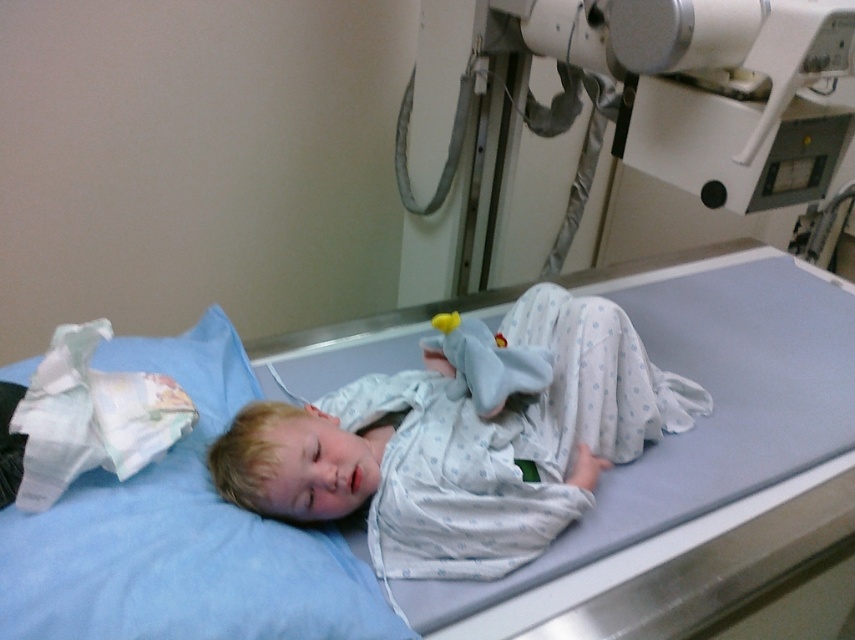
Does light blue fabric at center have a larger size compared to metallic gray machine at upper right?

Yes.

Can you confirm if light blue fabric at center is positioned to the right of metallic gray machine at upper right?

No, light blue fabric at center is not to the right of metallic gray machine at upper right.

What do you see at coordinates (361, 518) in the screenshot? This screenshot has height=640, width=855. I see `light blue fabric at center` at bounding box center [361, 518].

Locate an element on the screen. The image size is (855, 640). light blue fabric at center is located at coordinates (361, 518).

In the scene shown: Can you confirm if metallic gray machine at upper right is positioned to the right of white cotton pajamas at center?

Indeed, metallic gray machine at upper right is positioned on the right side of white cotton pajamas at center.

Does metallic gray machine at upper right have a smaller size compared to white cotton pajamas at center?

Actually, metallic gray machine at upper right might be larger than white cotton pajamas at center.

Is point (730, 161) positioned before point (236, 467)?

No, it is not.

The image size is (855, 640). What are the coordinates of `metallic gray machine at upper right` in the screenshot? It's located at (621, 109).

The width and height of the screenshot is (855, 640). Describe the element at coordinates (361, 518) in the screenshot. I see `light blue fabric at center` at that location.

Is point (363, 612) more distant than point (208, 337)?

No, it is in front of (208, 337).

Identify the location of light blue fabric at center. Image resolution: width=855 pixels, height=640 pixels. (361, 518).